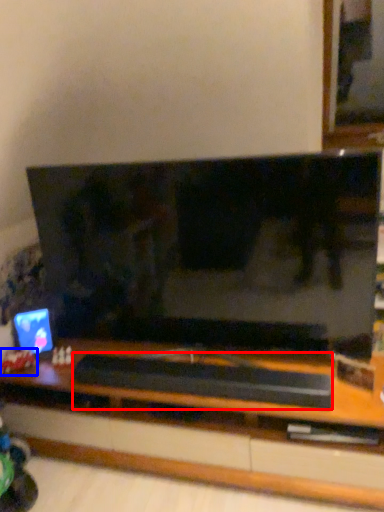
Question: Which object is further to the camera taking this photo, wide (highlighted by a red box) or toy (highlighted by a blue box)?

Choices:
 (A) wide
 (B) toy

Answer: (B)